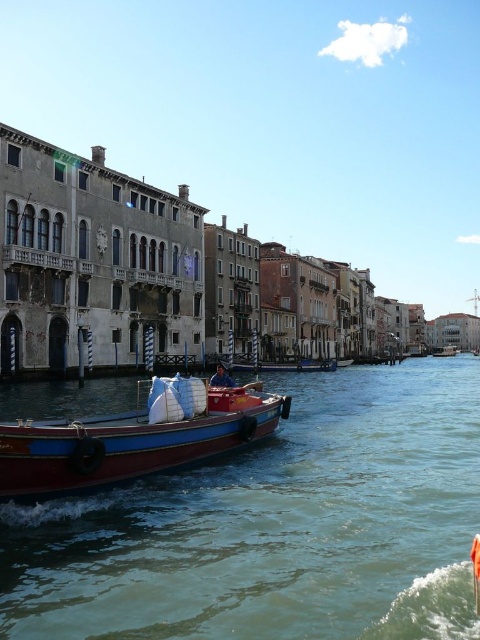
Question: Estimate the real-world distances between objects in this image. Which object is closer to the greenish-blue water at center?

Choices:
 (A) wooden boat at center
 (B) wooden boat at right

Answer: (A)

Question: Is the position of wooden boat at center less distant than that of wooden boat at right?

Choices:
 (A) no
 (B) yes

Answer: (B)

Question: Can you confirm if greenish-blue water at center is wider than wooden boat at right?

Choices:
 (A) no
 (B) yes

Answer: (B)

Question: Does wooden boat at center appear over wooden boat at right?

Choices:
 (A) no
 (B) yes

Answer: (B)

Question: Which point appears farthest from the camera in this image?

Choices:
 (A) (36, 490)
 (B) (451, 346)

Answer: (B)

Question: Which is nearer to the wooden boat at right?

Choices:
 (A) wooden boat at center
 (B) greenish-blue water at center

Answer: (B)